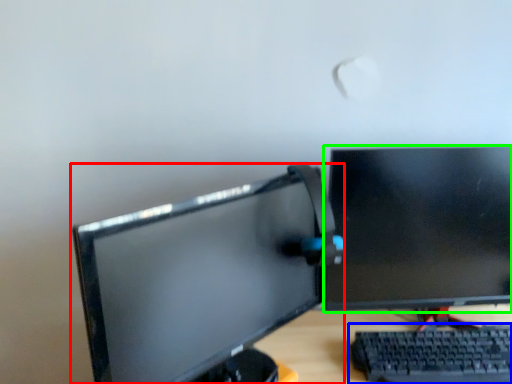
Question: Which object is positioned farthest from computer monitor (highlighted by a red box)? Select from computer keyboard (highlighted by a blue box) and computer monitor (highlighted by a green box).

Choices:
 (A) computer keyboard
 (B) computer monitor

Answer: (A)